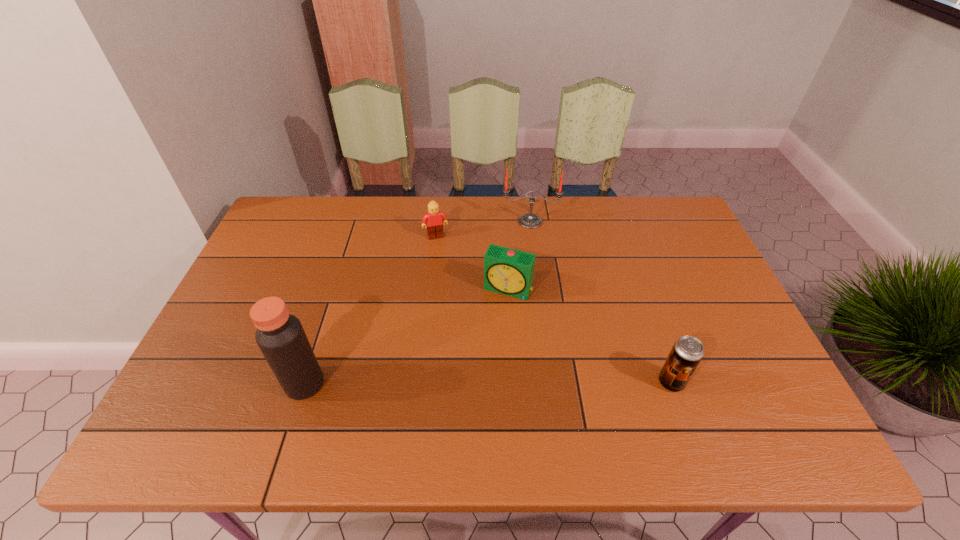
This screenshot has width=960, height=540. I want to click on free space located 0.360m on the face of the second farthest object, so click(466, 327).

The width and height of the screenshot is (960, 540). I want to click on vacant region located 0.200m on the face of the second farthest object, so click(452, 284).

Find the location of a particular element. free space located 0.050m on the face of the second farthest object is located at coordinates (442, 250).

You are a GUI agent. You are given a task and a screenshot of the screen. Output one action in this format:
    pyautogui.click(x=<x>, y=<y>)
    Task: Click on the vacant space located on the front-facing side of the alarm clock
    Image resolution: width=960 pixels, height=540 pixels.
    Given the screenshot: What is the action you would take?
    pyautogui.click(x=479, y=348)

The image size is (960, 540). I want to click on free space located 0.280m on the front-facing side of the alarm clock, so click(x=463, y=385).

Locate an element on the screen. This screenshot has width=960, height=540. vacant space situated 0.180m on the front-facing side of the alarm clock is located at coordinates (478, 351).

Where is `free space located on the front-facing side of the candle`? Image resolution: width=960 pixels, height=540 pixels. free space located on the front-facing side of the candle is located at coordinates (531, 258).

At what (x,y) coordinates should I click in order to perform the action: click on vacant space located 0.330m on the front-facing side of the candle. Please return your answer as a coordinate pair (x, y). The image size is (960, 540). Looking at the image, I should click on (533, 306).

Where is `free spot located on the front-facing side of the candle`? The width and height of the screenshot is (960, 540). free spot located on the front-facing side of the candle is located at coordinates (532, 285).

Locate an element on the screen. Image resolution: width=960 pixels, height=540 pixels. Lego present at the far edge is located at coordinates (433, 219).